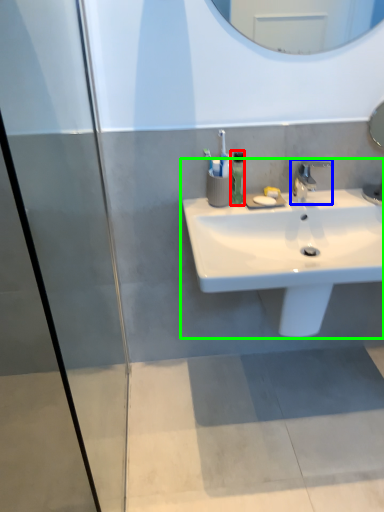
Question: Which object is the closest to the soap dispenser (highlighted by a red box)? Choose among these: tap (highlighted by a blue box) or sink (highlighted by a green box).

Choices:
 (A) tap
 (B) sink

Answer: (A)